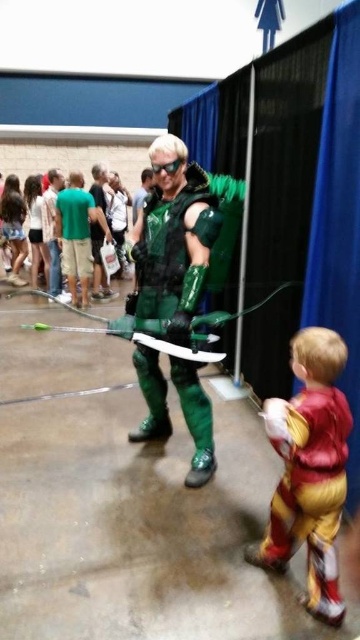
Question: Can you confirm if shiny yellow costume at lower right is smaller than green metallic armor at center?

Choices:
 (A) yes
 (B) no

Answer: (A)

Question: Does green shiny costume at center have a greater width compared to green metallic armor at center?

Choices:
 (A) yes
 (B) no

Answer: (A)

Question: Which point is closer to the camera taking this photo?

Choices:
 (A) (190, 387)
 (B) (275, 544)

Answer: (B)

Question: Estimate the real-world distances between objects in this image. Which object is closer to the green metallic armor at center?

Choices:
 (A) shiny yellow costume at lower right
 (B) green shiny costume at center

Answer: (B)

Question: Which of the following is the closest to the observer?

Choices:
 (A) (199, 456)
 (B) (105, 214)
 (C) (343, 461)

Answer: (C)

Question: In this image, where is shiny yellow costume at lower right located relative to green metallic armor at center?

Choices:
 (A) above
 (B) below

Answer: (B)